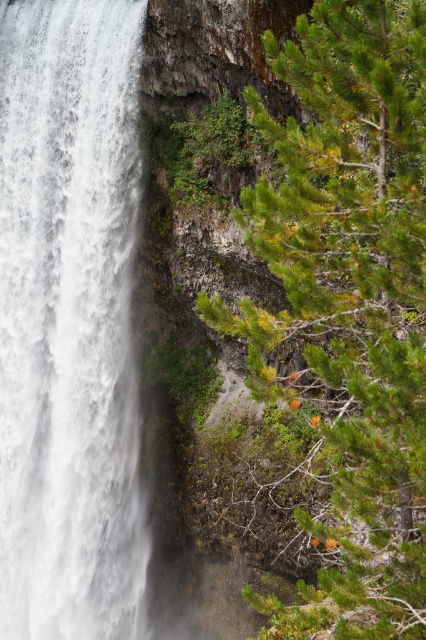
Is green needle-like tree at right positioned at the back of white frothy water at left?

No.

What do you see at coordinates (348, 305) in the screenshot? Image resolution: width=426 pixels, height=640 pixels. I see `green needle-like tree at right` at bounding box center [348, 305].

Where is `green needle-like tree at right`? This screenshot has width=426, height=640. green needle-like tree at right is located at coordinates (348, 305).